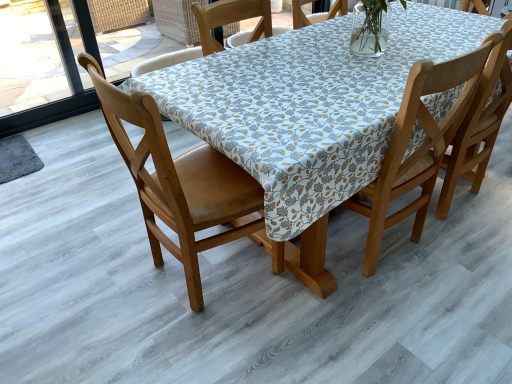
Question: Is wooden chair at center, which is counted as the first chair, starting from the right, facing away from wooden chair at left, positioned as the 2th chair in right-to-left order?

Choices:
 (A) yes
 (B) no

Answer: (B)

Question: From the image's perspective, does wooden chair at center, the 2th chair in the left-to-right sequence, appear higher than wooden chair at left, positioned as the 2th chair in right-to-left order?

Choices:
 (A) no
 (B) yes

Answer: (B)

Question: From a real-world perspective, is wooden chair at center, which is counted as the first chair, starting from the right, physically below wooden chair at left, which is the first chair from left to right?

Choices:
 (A) no
 (B) yes

Answer: (A)

Question: Can wooden chair at left, positioned as the 2th chair in right-to-left order, be found inside wooden chair at center, the 2th chair in the left-to-right sequence?

Choices:
 (A) no
 (B) yes

Answer: (A)

Question: Considering the relative sizes of wooden chair at center, the 2th chair in the left-to-right sequence, and wooden chair at left, which is the first chair from left to right, in the image provided, is wooden chair at center, the 2th chair in the left-to-right sequence, thinner than wooden chair at left, which is the first chair from left to right,?

Choices:
 (A) yes
 (B) no

Answer: (A)

Question: Is wooden chair at center, which is counted as the first chair, starting from the right, aimed at wooden chair at left, which is the first chair from left to right?

Choices:
 (A) yes
 (B) no

Answer: (B)

Question: Is wooden chair at left, which is the first chair from left to right, positioned far away from wooden chair at center, which is counted as the first chair, starting from the right?

Choices:
 (A) no
 (B) yes

Answer: (A)

Question: Is the surface of wooden chair at left, which is the first chair from left to right, in direct contact with wooden chair at center, which is counted as the first chair, starting from the right?

Choices:
 (A) yes
 (B) no

Answer: (B)

Question: Considering the relative sizes of wooden chair at left, which is the first chair from left to right, and wooden chair at center, the 2th chair in the left-to-right sequence, in the image provided, is wooden chair at left, which is the first chair from left to right, taller than wooden chair at center, the 2th chair in the left-to-right sequence,?

Choices:
 (A) yes
 (B) no

Answer: (A)

Question: From the image's perspective, would you say wooden chair at left, which is the first chair from left to right, is shown under wooden chair at center, the 2th chair in the left-to-right sequence?

Choices:
 (A) yes
 (B) no

Answer: (A)

Question: From a real-world perspective, is wooden chair at left, positioned as the 2th chair in right-to-left order, positioned under wooden chair at center, which is counted as the first chair, starting from the right, based on gravity?

Choices:
 (A) no
 (B) yes

Answer: (B)

Question: Is wooden chair at left, which is the first chair from left to right, thinner than wooden chair at center, which is counted as the first chair, starting from the right?

Choices:
 (A) no
 (B) yes

Answer: (A)

Question: From the image's perspective, is wooden chair at center, which is counted as the first chair, starting from the right, located above or below wooden chair at left, which is the first chair from left to right?

Choices:
 (A) below
 (B) above

Answer: (B)